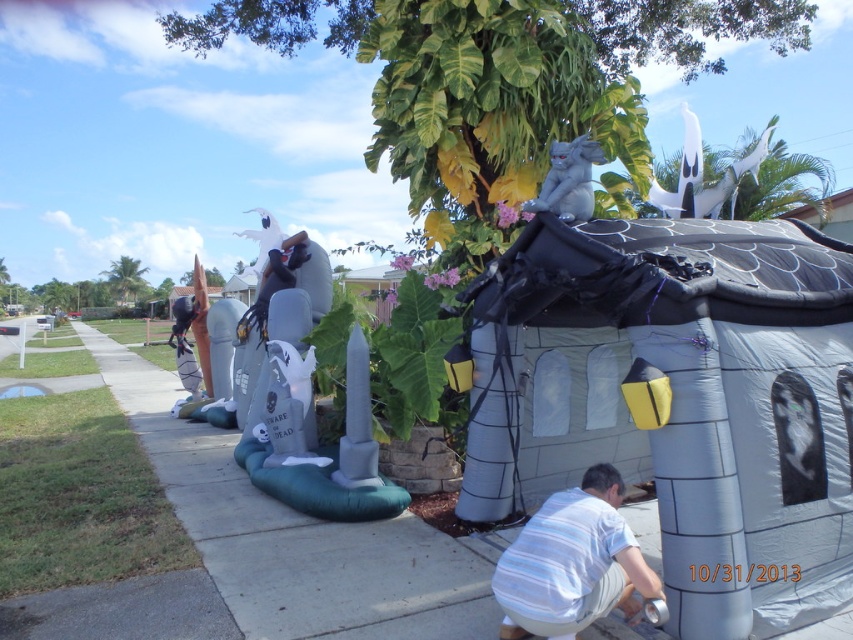
Question: Is gray concrete sidewalk at lower left above white striped shirt at lower center?

Choices:
 (A) no
 (B) yes

Answer: (A)

Question: Which point is farther to the camera?

Choices:
 (A) white glossy ghost at upper center
 (B) gray concrete sidewalk at lower left
 (C) inflatable gray at left

Answer: (A)

Question: Which point is farther from the camera taking this photo?

Choices:
 (A) (682, 205)
 (B) (287, 531)
 (C) (567, 541)

Answer: (A)

Question: In this image, where is gray concrete sidewalk at lower left located relative to white striped shirt at lower center?

Choices:
 (A) above
 (B) below

Answer: (B)

Question: Can you confirm if white striped shirt at lower center is positioned above white glossy ghost at upper center?

Choices:
 (A) yes
 (B) no

Answer: (B)

Question: Considering the real-world distances, which object is farthest from the white striped shirt at lower center?

Choices:
 (A) gray concrete sidewalk at lower left
 (B) inflatable gray at left

Answer: (B)